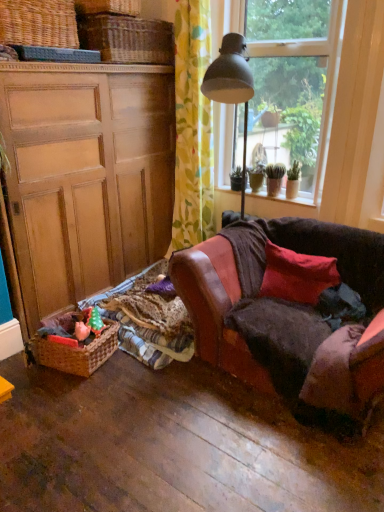
Question: Is woven brown picnic basket at lower left, which is counted as the 1th picnic basket, starting from the bottom, completely or partially outside of clear glass window at upper right?

Choices:
 (A) yes
 (B) no

Answer: (A)

Question: Could clear glass window at upper right be considered to be inside woven brown picnic basket at lower left, which is counted as the 1th picnic basket, starting from the bottom?

Choices:
 (A) yes
 (B) no

Answer: (B)

Question: Is clear glass window at upper right at the back of woven brown picnic basket at lower left, placed as the 2th picnic basket when sorted from top to bottom?

Choices:
 (A) yes
 (B) no

Answer: (B)

Question: Considering the relative sizes of woven brown picnic basket at lower left, which is counted as the 1th picnic basket, starting from the bottom, and clear glass window at upper right in the image provided, is woven brown picnic basket at lower left, which is counted as the 1th picnic basket, starting from the bottom, bigger than clear glass window at upper right?

Choices:
 (A) yes
 (B) no

Answer: (B)

Question: Is woven brown picnic basket at lower left, placed as the 2th picnic basket when sorted from top to bottom, further to camera compared to clear glass window at upper right?

Choices:
 (A) no
 (B) yes

Answer: (A)

Question: Considering the relative sizes of woven brown picnic basket at lower left, placed as the 2th picnic basket when sorted from top to bottom, and clear glass window at upper right in the image provided, is woven brown picnic basket at lower left, placed as the 2th picnic basket when sorted from top to bottom, wider than clear glass window at upper right?

Choices:
 (A) no
 (B) yes

Answer: (B)

Question: Can you confirm if clear glass window at upper right is bigger than woven wicker basket at upper left, arranged as the second basket when viewed from the back?

Choices:
 (A) yes
 (B) no

Answer: (A)

Question: Considering the relative positions of clear glass window at upper right and woven wicker basket at upper left, arranged as the second basket when viewed from the back, in the image provided, is clear glass window at upper right behind woven wicker basket at upper left, arranged as the second basket when viewed from the back,?

Choices:
 (A) no
 (B) yes

Answer: (B)

Question: Is clear glass window at upper right facing towards woven wicker basket at upper left, arranged as the second basket when viewed from the back?

Choices:
 (A) no
 (B) yes

Answer: (A)

Question: Is clear glass window at upper right not inside woven wicker basket at upper left, arranged as the second basket when viewed from the back?

Choices:
 (A) no
 (B) yes

Answer: (B)

Question: Does clear glass window at upper right appear on the left side of woven wicker basket at upper left, positioned as the first basket in front-to-back order?

Choices:
 (A) yes
 (B) no

Answer: (B)

Question: Is clear glass window at upper right smaller than woven wicker basket at upper left, positioned as the first basket in front-to-back order?

Choices:
 (A) yes
 (B) no

Answer: (B)

Question: From the image's perspective, is woven brown picnic basket at lower left, placed as the 2th picnic basket when sorted from top to bottom, over smooth concrete window sill at center?

Choices:
 (A) yes
 (B) no

Answer: (B)